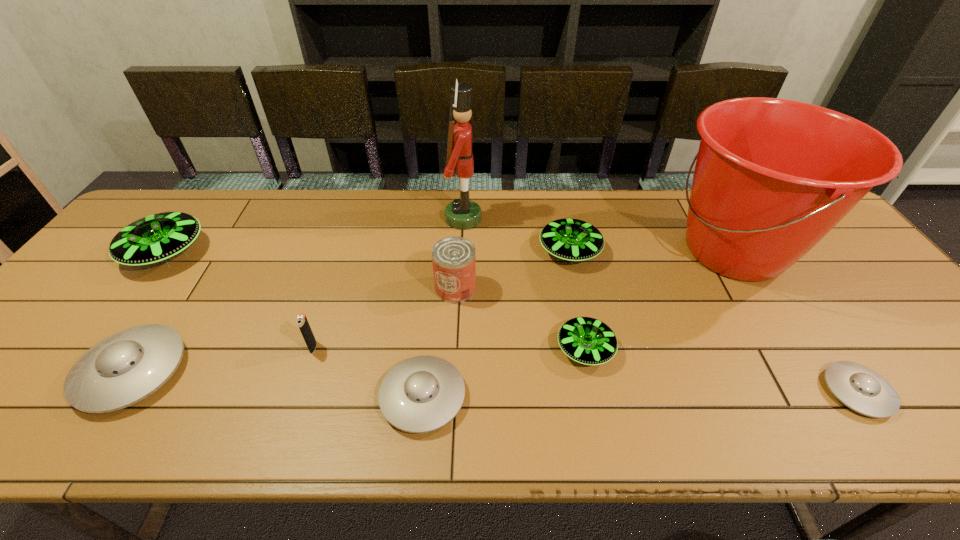
What are the coordinates of `the fifth shortest object` in the screenshot? It's located at (569, 239).

This screenshot has height=540, width=960. I want to click on the leftmost gray saucer, so 126,367.

The width and height of the screenshot is (960, 540). I want to click on the smallest green saucer, so click(589, 341).

Find the location of a particular element. This screenshot has height=540, width=960. the second gray saucer from left to right is located at coordinates (421, 394).

You are a GUI agent. You are given a task and a screenshot of the screen. Output one action in this format:
    pyautogui.click(x=<x>, y=<y>)
    Task: Click on the second biggest gray saucer
    The image size is (960, 540).
    Given the screenshot: What is the action you would take?
    pyautogui.click(x=421, y=394)

Find the location of `the smallest gray saucer`. the smallest gray saucer is located at coordinates (860, 388).

Find the location of a particular element. The height and width of the screenshot is (540, 960). the shortest object is located at coordinates (860, 388).

This screenshot has height=540, width=960. Identify the location of vacant space located 0.120m on the front-facing side of the green nutcracker. (520, 218).

Find the location of `vacant space positioned 0.260m with the handle attached to the rim of the second tallest object`. vacant space positioned 0.260m with the handle attached to the rim of the second tallest object is located at coordinates (569, 251).

The width and height of the screenshot is (960, 540). Find the location of `vacant space situated 0.380m with the handle attached to the rim of the second tallest object`. vacant space situated 0.380m with the handle attached to the rim of the second tallest object is located at coordinates (528, 251).